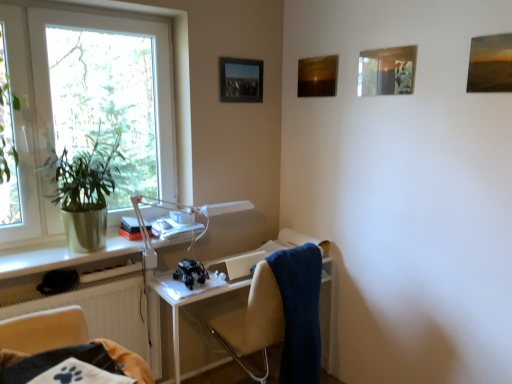
Question: Is matte wooden picture frame at upper right, marked as the fourth picture frame in a left-to-right arrangement, located outside metallic silver picture frame at upper center, the first picture frame viewed from the left?

Choices:
 (A) no
 (B) yes

Answer: (B)

Question: Is matte wooden picture frame at upper right, marked as the fourth picture frame in a left-to-right arrangement, positioned behind metallic silver picture frame at upper center, placed as the fourth picture frame when sorted from front to back?

Choices:
 (A) yes
 (B) no

Answer: (B)

Question: From a real-world perspective, is matte wooden picture frame at upper right, which is the 4th picture frame from back to front, over metallic silver picture frame at upper center, the 4th picture frame viewed from the right?

Choices:
 (A) yes
 (B) no

Answer: (A)

Question: Is matte wooden picture frame at upper right, the 1th picture frame in the right-to-left sequence, facing away from metallic silver picture frame at upper center, placed as the fourth picture frame when sorted from front to back?

Choices:
 (A) no
 (B) yes

Answer: (A)

Question: Is matte wooden picture frame at upper right, the 1th picture frame in the right-to-left sequence, touching metallic silver picture frame at upper center, marked as the 1th picture frame in a back-to-front arrangement?

Choices:
 (A) no
 (B) yes

Answer: (A)

Question: In terms of width, does matte wooden picture frame at upper right, the 1th picture frame in the right-to-left sequence, look wider or thinner when compared to matte wooden picture frame at upper center, the 2th picture frame from the left?

Choices:
 (A) thin
 (B) wide

Answer: (B)

Question: From their relative heights in the image, would you say matte wooden picture frame at upper right, which is the 4th picture frame from back to front, is taller or shorter than matte wooden picture frame at upper center, the third picture frame positioned from the front?

Choices:
 (A) tall
 (B) short

Answer: (B)

Question: Is matte wooden picture frame at upper right, marked as the fourth picture frame in a left-to-right arrangement, bigger or smaller than matte wooden picture frame at upper center, the 2th picture frame from the left?

Choices:
 (A) small
 (B) big

Answer: (B)

Question: Is matte wooden picture frame at upper right, the 1th picture frame in the right-to-left sequence, in front of or behind matte wooden picture frame at upper center, the 2th picture frame from the left, in the image?

Choices:
 (A) behind
 (B) front

Answer: (B)

Question: Looking at their shapes, would you say white plastic window at left is wider or thinner than beige fabric chair at center, arranged as the second chair when viewed from the left?

Choices:
 (A) thin
 (B) wide

Answer: (A)

Question: Visually, is white plastic window at left positioned to the left or to the right of beige fabric chair at center, which is the first chair from back to front?

Choices:
 (A) right
 (B) left

Answer: (B)

Question: From the image's perspective, is white plastic window at left located above or below beige fabric chair at center, the 1th chair in the right-to-left sequence?

Choices:
 (A) below
 (B) above

Answer: (B)

Question: Would you say white plastic window at left is inside or outside beige fabric chair at center, the 1th chair in the right-to-left sequence?

Choices:
 (A) outside
 (B) inside

Answer: (A)

Question: Considering the positions of blue soft towel at right and beige fabric chair at lower left, the second chair viewed from the right, in the image, is blue soft towel at right taller or shorter than beige fabric chair at lower left, the second chair viewed from the right,?

Choices:
 (A) short
 (B) tall

Answer: (B)

Question: Is blue soft towel at right wider or thinner than beige fabric chair at lower left, the first chair viewed from the left?

Choices:
 (A) wide
 (B) thin

Answer: (B)